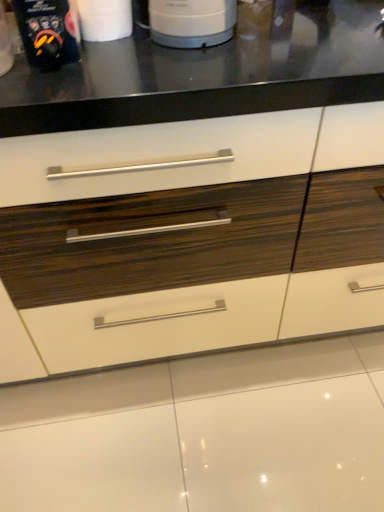
Where is `matte black coffee maker at upper left`? matte black coffee maker at upper left is located at coordinates (47, 32).

This screenshot has width=384, height=512. Identify the location of matte black coffee maker at upper left. (47, 32).

Is white matte paper towel at upper left taller than white glossy drawer at center?

No.

Between white matte paper towel at upper left and white glossy drawer at center, which one has smaller size?

Smaller between the two is white matte paper towel at upper left.

What's the angular difference between white matte paper towel at upper left and white glossy drawer at center's facing directions?

The angle between the facing direction of white matte paper towel at upper left and the facing direction of white glossy drawer at center is 0.00242 degrees.

From the image's perspective, would you say white matte paper towel at upper left is shown under white glossy drawer at center?

No.

Which is more to the left, white glossy drawer at center or matte black coffee maker at upper left?

Positioned to the left is matte black coffee maker at upper left.

Is white glossy drawer at center facing away from matte black coffee maker at upper left?

No, matte black coffee maker at upper left is not at the back of white glossy drawer at center.

Does white glossy drawer at center have a lesser width compared to matte black coffee maker at upper left?

No.

Considering the positions of objects white glossy drawer at center and matte black coffee maker at upper left in the image provided, who is behind, white glossy drawer at center or matte black coffee maker at upper left?

white glossy drawer at center is further away from the camera.

Is white matte paper towel at upper left surrounding matte black coffee maker at upper left?

No, matte black coffee maker at upper left is located outside of white matte paper towel at upper left.

Based on the photo, from a real-world perspective, is white matte paper towel at upper left over matte black coffee maker at upper left?

Actually, white matte paper towel at upper left is physically below matte black coffee maker at upper left in the real world.

Is white matte paper towel at upper left positioned with its back to matte black coffee maker at upper left?

No, matte black coffee maker at upper left is not at the back of white matte paper towel at upper left.

Which is more to the right, white matte paper towel at upper left or matte black coffee maker at upper left?

white matte paper towel at upper left is more to the right.

Who is more distant, matte black coffee maker at upper left or white glossy drawer at center?

white glossy drawer at center is behind.

Considering the sizes of objects matte black coffee maker at upper left and white glossy drawer at center in the image provided, who is smaller, matte black coffee maker at upper left or white glossy drawer at center?

matte black coffee maker at upper left.

Is matte black coffee maker at upper left situated inside white glossy drawer at center or outside?

matte black coffee maker at upper left is spatially situated outside white glossy drawer at center.

Is matte black coffee maker at upper left wider than white glossy drawer at center?

No, matte black coffee maker at upper left is not wider than white glossy drawer at center.

Looking at the image, does white glossy drawer at center seem bigger or smaller compared to white matte paper towel at upper left?

Clearly, white glossy drawer at center is larger in size than white matte paper towel at upper left.

Is white glossy drawer at center spatially inside white matte paper towel at upper left, or outside of it?

white glossy drawer at center is not enclosed by white matte paper towel at upper left.

Which object is more forward, white glossy drawer at center or white matte paper towel at upper left?

white glossy drawer at center.

Between matte black coffee maker at upper left and white matte paper towel at upper left, which one has smaller width?

Thinner between the two is white matte paper towel at upper left.

Consider the image. Would you say matte black coffee maker at upper left is to the left or to the right of white matte paper towel at upper left in the picture?

From the image, it's evident that matte black coffee maker at upper left is to the left of white matte paper towel at upper left.

Considering the positions of point (36, 58) and point (124, 9), is point (36, 58) closer or farther from the camera than point (124, 9)?

Point (36, 58) appears to be closer to the viewer than point (124, 9).

This screenshot has height=512, width=384. What are the coordinates of `paper towel behind the matte black coffee maker at upper left` in the screenshot? It's located at (105, 19).

Where is `paper towel on the left of white glossy drawer at center`? paper towel on the left of white glossy drawer at center is located at coordinates (105, 19).

This screenshot has height=512, width=384. What are the coordinates of `drawer behind the matte black coffee maker at upper left` in the screenshot? It's located at (191, 153).

Which object lies nearer to the anchor point matte black coffee maker at upper left, white matte paper towel at upper left or white glossy drawer at center?

Among the two, white matte paper towel at upper left is located nearer to matte black coffee maker at upper left.

Considering their positions, is white matte paper towel at upper left positioned closer to white glossy drawer at center than matte black coffee maker at upper left?

matte black coffee maker at upper left lies closer to white glossy drawer at center than the other object.

From the image, which object appears to be farther from white glossy drawer at center, matte black coffee maker at upper left or white matte paper towel at upper left?

white matte paper towel at upper left.

When comparing their distances from matte black coffee maker at upper left, does white glossy drawer at center or white matte paper towel at upper left seem closer?

white matte paper towel at upper left.

Based on their spatial positions, is matte black coffee maker at upper left or white glossy drawer at center further from white matte paper towel at upper left?

white glossy drawer at center is further to white matte paper towel at upper left.

Estimate the real-world distances between objects in this image. Which object is further from white matte paper towel at upper left, white glossy drawer at center or matte black coffee maker at upper left?

Among the two, white glossy drawer at center is located further to white matte paper towel at upper left.

You are a GUI agent. You are given a task and a screenshot of the screen. Output one action in this format:
    pyautogui.click(x=<x>, y=<y>)
    Task: Click on the paper towel between matte black coffee maker at upper left and white glossy drawer at center from left to right
    The image size is (384, 512).
    Given the screenshot: What is the action you would take?
    pyautogui.click(x=105, y=19)